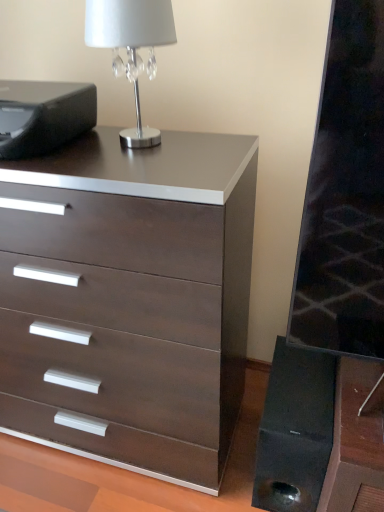
You are a GUI agent. You are given a task and a screenshot of the screen. Output one action in this format:
    pyautogui.click(x=<x>, y=<y>)
    Task: Click on the free point above black matte speaker at lower right (from a real-world perspective)
    This screenshot has height=512, width=384.
    Given the screenshot: What is the action you would take?
    pyautogui.click(x=297, y=393)